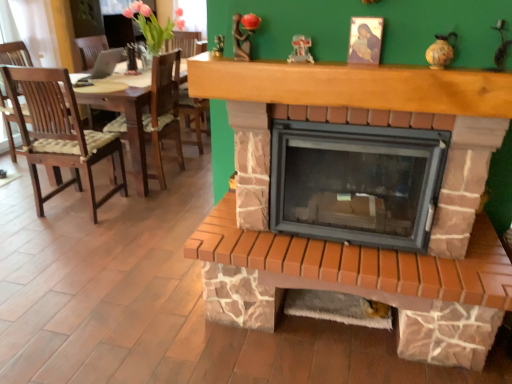
Question: Is brick fireplace at center smaller than brown wood mantle at upper center?

Choices:
 (A) no
 (B) yes

Answer: (A)

Question: From a real-world perspective, is brick fireplace at center physically below brown wood mantle at upper center?

Choices:
 (A) yes
 (B) no

Answer: (A)

Question: Is brick fireplace at center to the left of brown wood mantle at upper center from the viewer's perspective?

Choices:
 (A) no
 (B) yes

Answer: (A)

Question: Is brick fireplace at center turned away from brown wood mantle at upper center?

Choices:
 (A) yes
 (B) no

Answer: (B)

Question: Considering the relative sizes of brick fireplace at center and brown wood mantle at upper center in the image provided, is brick fireplace at center shorter than brown wood mantle at upper center?

Choices:
 (A) yes
 (B) no

Answer: (B)

Question: From the image's perspective, would you say brick fireplace at center is shown under brown wood mantle at upper center?

Choices:
 (A) yes
 (B) no

Answer: (A)

Question: From the image's perspective, is brown wood mantle at upper center on brick fireplace at center?

Choices:
 (A) yes
 (B) no

Answer: (A)

Question: Is brown wood mantle at upper center oriented away from brick fireplace at center?

Choices:
 (A) yes
 (B) no

Answer: (B)

Question: Can you confirm if brown wood mantle at upper center is shorter than brick fireplace at center?

Choices:
 (A) yes
 (B) no

Answer: (A)

Question: Is brown wood mantle at upper center oriented towards brick fireplace at center?

Choices:
 (A) no
 (B) yes

Answer: (A)

Question: From the image's perspective, would you say brown wood mantle at upper center is shown under brick fireplace at center?

Choices:
 (A) no
 (B) yes

Answer: (A)

Question: Are brown wood mantle at upper center and brick fireplace at center far apart?

Choices:
 (A) yes
 (B) no

Answer: (B)

Question: Would you say brick fireplace at center is to the left or to the right of brown wood mantle at upper center in the picture?

Choices:
 (A) right
 (B) left

Answer: (A)